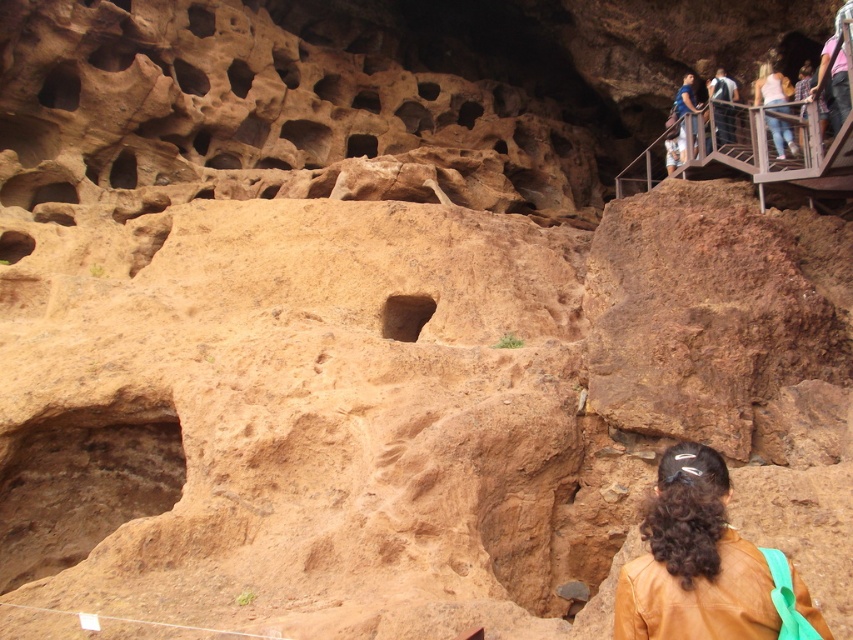
Question: Can you confirm if brown leather jacket at lower right is smaller than blue denim jeans at upper right?

Choices:
 (A) yes
 (B) no

Answer: (A)

Question: Which object is closer to the camera taking this photo?

Choices:
 (A) blue denim jeans at upper right
 (B) brown rough cave at center
 (C) pink fabric at upper right
 (D) brown rough cave at lower left

Answer: (D)

Question: Which object appears farthest from the camera in this image?

Choices:
 (A) white cotton shirt at upper right
 (B) pink fabric at upper right
 (C) blue denim jeans at upper right

Answer: (C)

Question: Considering the relative positions of pink fabric at upper right and brown rough cave at center in the image provided, where is pink fabric at upper right located with respect to brown rough cave at center?

Choices:
 (A) above
 (B) below

Answer: (A)

Question: Based on their relative distances, which object is nearer to the blue denim jeans at upper right?

Choices:
 (A) brown rough cave at lower left
 (B) brown leather jacket at lower right

Answer: (A)

Question: Can you confirm if light blue denim jeans at upper right is positioned above white cotton shirt at upper right?

Choices:
 (A) yes
 (B) no

Answer: (B)